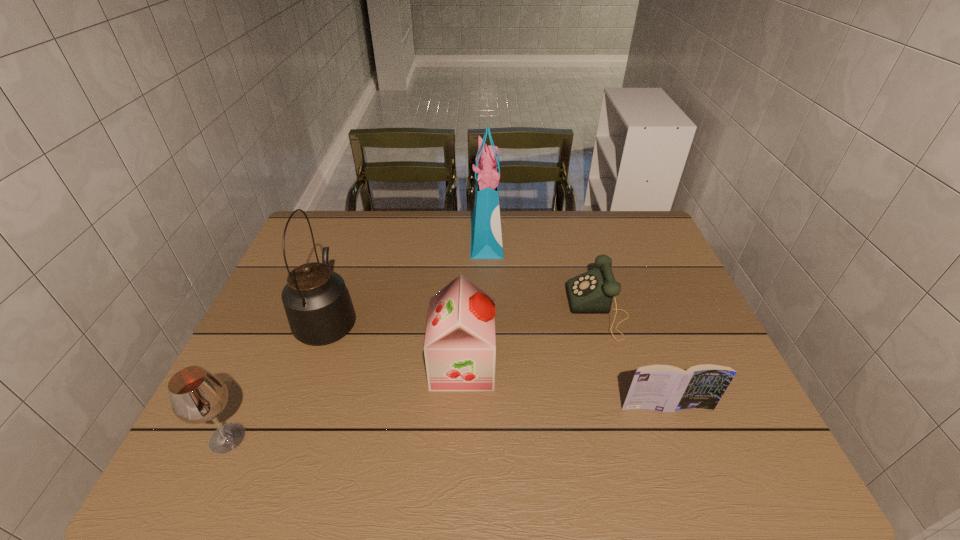
At what (x,y) coordinates should I click in order to perform the action: click on free space located 0.160m spout on the kettle. Please return your answer as a coordinate pair (x, y). This screenshot has height=540, width=960. Looking at the image, I should click on [x=351, y=255].

Where is `free space located 0.070m spout on the kettle`? Image resolution: width=960 pixels, height=540 pixels. free space located 0.070m spout on the kettle is located at coordinates (345, 274).

At what (x,y) coordinates should I click in order to perform the action: click on free region located with the cap open on the soya milk. Please return your answer as a coordinate pair (x, y). Looking at the image, I should click on (536, 365).

Where is `vacant region located on the right of the fourth tallest object`? The width and height of the screenshot is (960, 540). vacant region located on the right of the fourth tallest object is located at coordinates (x=293, y=438).

The image size is (960, 540). I want to click on vacant space located on the front cover of the fifth tallest object, so click(x=690, y=471).

Locate an element on the screen. The image size is (960, 540). vacant space located on the dial of the telephone is located at coordinates (499, 310).

Where is `free space located on the dial of the telephone`? free space located on the dial of the telephone is located at coordinates (495, 310).

At what (x,y) coordinates should I click in order to perform the action: click on vacant area situated on the dial of the telephone. Please return your answer as a coordinate pair (x, y). Looking at the image, I should click on (492, 310).

This screenshot has height=540, width=960. In order to click on object that is at the far edge in this screenshot , I will do `click(486, 232)`.

The width and height of the screenshot is (960, 540). In order to click on object that is positioned at the near edge in this screenshot , I will do `click(197, 396)`.